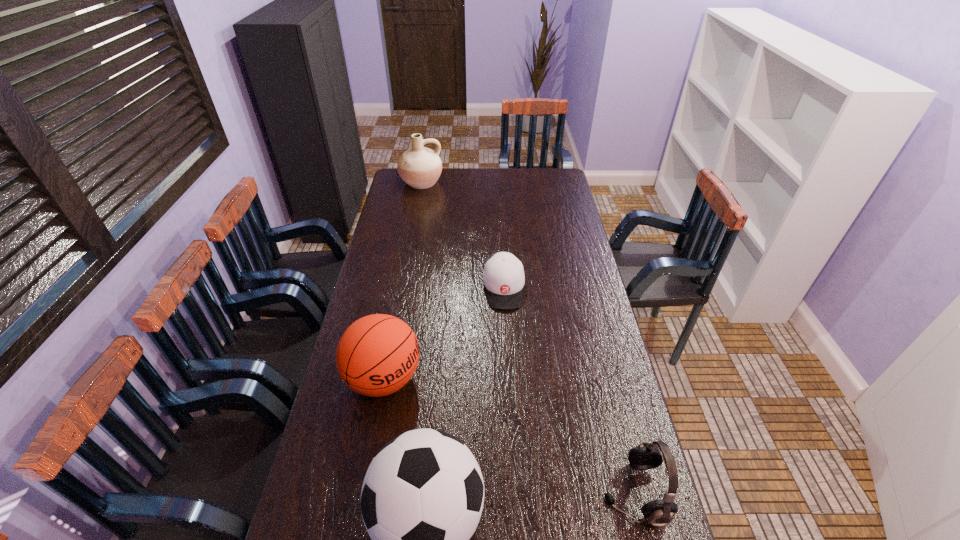
At what (x,y) coordinates should I click in order to perform the action: click on free spot on the desktop that is between the soccer ball and the fourth tallest object and is positioned on the side with logo of the basketball. Please return your answer as a coordinate pair (x, y). The width and height of the screenshot is (960, 540). Looking at the image, I should click on (562, 502).

In order to click on vacant space on the desktop that is between the soccer ball and the headset and is positioned to pour from the handle of the farthest object in this screenshot , I will do `click(540, 504)`.

You are a GUI agent. You are given a task and a screenshot of the screen. Output one action in this format:
    pyautogui.click(x=<x>, y=<y>)
    Task: Click on the free space on the desktop that is between the soccer ball and the headset and is positioned on the front-facing side of the baseball cap
    
    Given the screenshot: What is the action you would take?
    pyautogui.click(x=519, y=507)